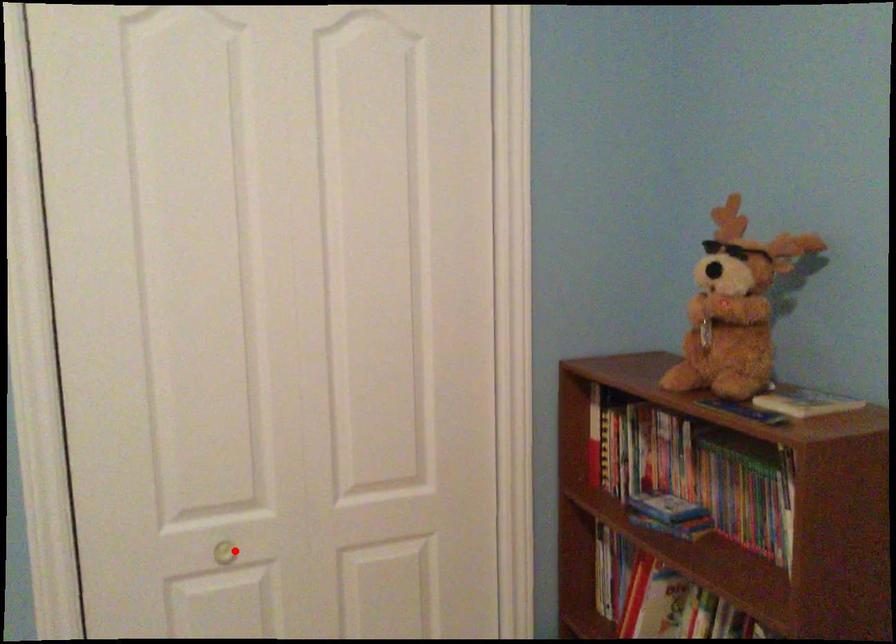
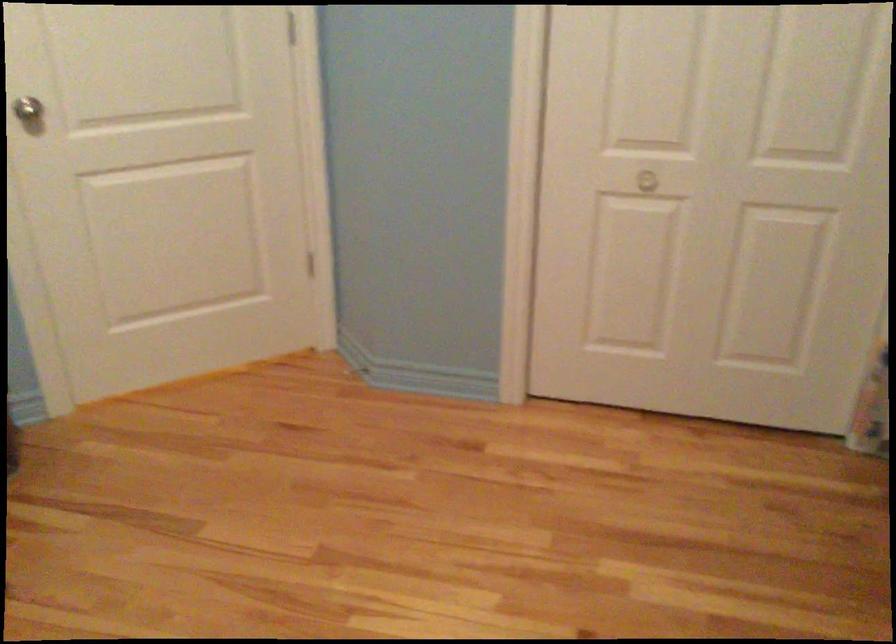
Where in the second image is the point corresponding to the highlighted location from the first image?

(658, 176)